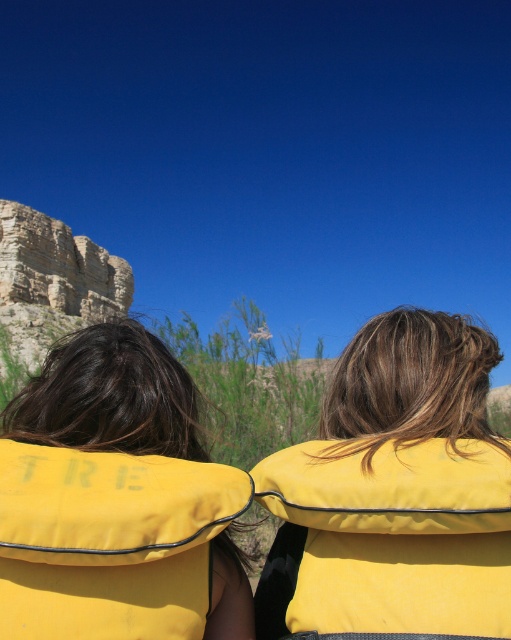
Does yellow fabric life vest at center have a lesser height compared to yellow fabric life jacket at center?

In fact, yellow fabric life vest at center may be taller than yellow fabric life jacket at center.

Consider the image. Can you confirm if yellow fabric life vest at center is positioned above yellow fabric life jacket at center?

Yes, yellow fabric life vest at center is above yellow fabric life jacket at center.

Identify the location of yellow fabric life vest at center. (256, 497).

Can you confirm if yellow fabric life vest at center is smaller than yellow fabric life jacket at upper center?

No.

Which is below, yellow fabric life vest at center or yellow fabric life jacket at upper center?

yellow fabric life jacket at upper center is lower down.

Does point (42, 528) lie in front of point (143, 627)?

Yes.

Locate an element on the screen. The width and height of the screenshot is (511, 640). yellow fabric life vest at center is located at coordinates (256, 497).

Does yellow fabric life jacket at center appear over yellow fabric life jacket at upper center?

Actually, yellow fabric life jacket at center is below yellow fabric life jacket at upper center.

I want to click on yellow fabric life jacket at center, so click(386, 540).

Which is in front, point (445, 582) or point (127, 502)?

Point (445, 582)

Locate an element on the screen. The height and width of the screenshot is (640, 511). yellow fabric life jacket at center is located at coordinates (386, 540).